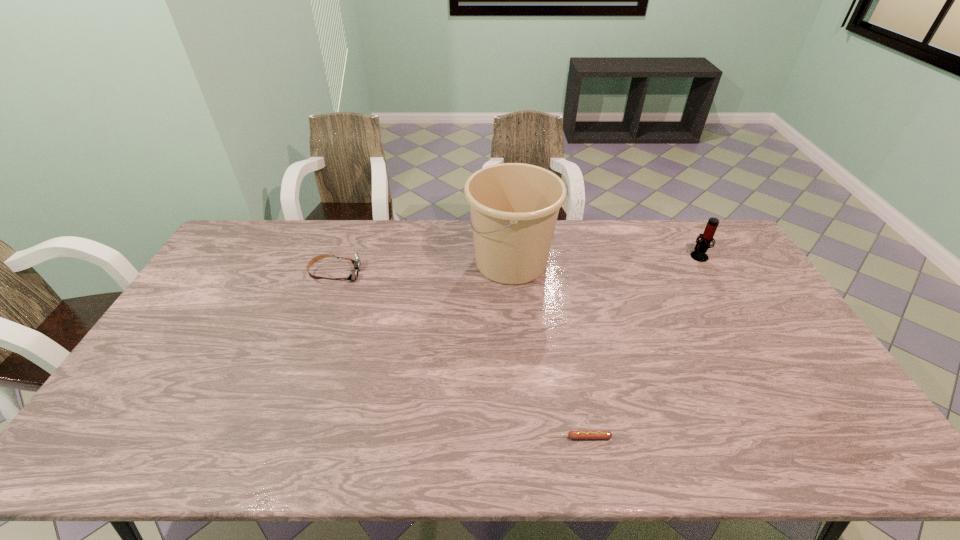
The height and width of the screenshot is (540, 960). Identify the location of free point at the far left corner. (276, 228).

Find the location of a particular element. free spot between the nearest object and the second shortest object is located at coordinates (457, 355).

Locate an element on the screen. This screenshot has width=960, height=540. vacant space in between the second tallest object and the shortest object is located at coordinates (638, 346).

You are a GUI agent. You are given a task and a screenshot of the screen. Output one action in this format:
    pyautogui.click(x=<x>, y=<y>)
    Task: Click on the free point between the shortest object and the goggles
    The width and height of the screenshot is (960, 540).
    Given the screenshot: What is the action you would take?
    pyautogui.click(x=457, y=355)

Find the location of a particular element. Image resolution: width=960 pixels, height=540 pixels. blank region between the nearest object and the leftmost object is located at coordinates (457, 355).

Where is `blank region between the rightmost object and the nearest object`? This screenshot has height=540, width=960. blank region between the rightmost object and the nearest object is located at coordinates (638, 346).

Identify the location of free space that is in between the sausage and the third tallest object. (457, 355).

You are a GUI agent. You are given a task and a screenshot of the screen. Output one action in this format:
    pyautogui.click(x=<x>, y=<y>)
    Task: Click on the free space between the microphone and the sausage
    This screenshot has width=960, height=540.
    Given the screenshot: What is the action you would take?
    pyautogui.click(x=638, y=346)

Locate an element on the screen. This screenshot has width=960, height=540. vacant space that's between the bucket and the second shortest object is located at coordinates (423, 267).

You are a GUI agent. You are given a task and a screenshot of the screen. Output one action in this format:
    pyautogui.click(x=<x>, y=<y>)
    Task: Click on the second closest object to the leftmost object
    
    Given the screenshot: What is the action you would take?
    pyautogui.click(x=571, y=434)